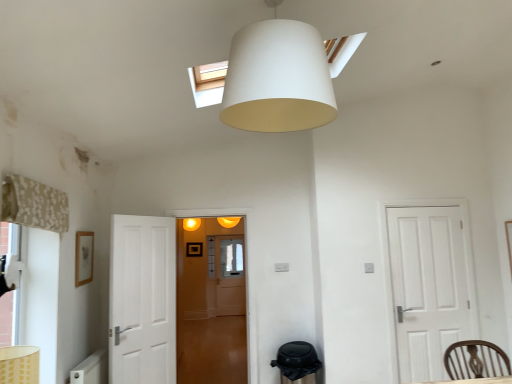
The height and width of the screenshot is (384, 512). Find the location of `beige floral fabric curtain at left`. beige floral fabric curtain at left is located at coordinates (34, 204).

Identify the location of translucent wooden door at center. click(x=211, y=305).

Identify the location of white matte door at right. Image resolution: width=512 pixels, height=384 pixels. (428, 287).

Locate an element on the screen. Image resolution: width=512 pixels, height=384 pixels. beige floral fabric curtain at left is located at coordinates (34, 204).

From a real-world perspective, is beige floral fabric curtain at left over translucent wooden door at center?

Correct, in the physical world, beige floral fabric curtain at left is higher than translucent wooden door at center.

Can you confirm if beige floral fabric curtain at left is thinner than translucent wooden door at center?

Correct, the width of beige floral fabric curtain at left is less than that of translucent wooden door at center.

From the image's perspective, does beige floral fabric curtain at left appear higher than translucent wooden door at center?

Correct, beige floral fabric curtain at left appears higher than translucent wooden door at center in the image.

Measure the distance between beige floral fabric curtain at left and translucent wooden door at center.

The distance of beige floral fabric curtain at left from translucent wooden door at center is 10.75 feet.

Based on the photo, would you say white matte door at right is inside or outside white matte lampshade at upper center?

white matte door at right exists outside the volume of white matte lampshade at upper center.

Find the location of a particular element. door on the right of white matte lampshade at upper center is located at coordinates (428, 287).

Relative to white matte lampshade at upper center, is white matte door at right in front or behind?

white matte door at right is behind white matte lampshade at upper center.

Are white matte door at right and white matte lampshade at upper center located far from each other?

white matte door at right is far away from white matte lampshade at upper center.

Is white matte lampshade at upper center wider or thinner than white matte door at right?

In the image, white matte lampshade at upper center appears to be wider than white matte door at right.

How many degrees apart are the facing directions of white matte lampshade at upper center and white matte door at right?

white matte lampshade at upper center and white matte door at right are facing 89.7 degrees away from each other.

Looking at this image, from the image's perspective, which one is positioned lower, white matte lampshade at upper center or white matte door at right?

white matte door at right, from the image's perspective.

Considering the relative sizes of white matte lampshade at upper center and white matte door at right in the image provided, is white matte lampshade at upper center smaller than white matte door at right?

No.

Is beige floral fabric curtain at left looking in the opposite direction of white matte lampshade at upper center?

beige floral fabric curtain at left does not have its back to white matte lampshade at upper center.

Is point (7, 202) closer or farther from the camera than point (258, 46)?

Point (7, 202) is positioned farther from the camera compared to point (258, 46).

Which object is closer to the camera, beige floral fabric curtain at left or white matte lampshade at upper center?

white matte lampshade at upper center is more forward.

Considering the relative positions of beige floral fabric curtain at left and white matte lampshade at upper center in the image provided, is beige floral fabric curtain at left to the right of white matte lampshade at upper center from the viewer's perspective?

In fact, beige floral fabric curtain at left is to the left of white matte lampshade at upper center.

Which object is further away from the camera, white matte door at right or beige floral fabric curtain at left?

white matte door at right is further away from the camera.

There is a white matte door at right. At what (x,y) coordinates should I click in order to perform the action: click on curtain above it (from a real-world perspective). Please return your answer as a coordinate pair (x, y). Image resolution: width=512 pixels, height=384 pixels. Looking at the image, I should click on (34, 204).

Who is smaller, white matte door at right or beige floral fabric curtain at left?

beige floral fabric curtain at left is smaller.

From the picture: Are white matte door at right and beige floral fabric curtain at left far apart?

white matte door at right is positioned a significant distance from beige floral fabric curtain at left.

Which object is more forward, translucent wooden door at center or white matte lampshade at upper center?

Positioned in front is white matte lampshade at upper center.

In terms of width, does translucent wooden door at center look wider or thinner when compared to white matte lampshade at upper center?

Clearly, translucent wooden door at center has less width compared to white matte lampshade at upper center.

Is translucent wooden door at center oriented away from white matte lampshade at upper center?

No.

Is point (473, 354) behind point (11, 213)?

Yes, it is.

Is brown wooden chair at lower right beside beige floral fabric curtain at left?

They are not placed beside each other.

Which of these two, brown wooden chair at lower right or beige floral fabric curtain at left, is thinner?

With smaller width is beige floral fabric curtain at left.

In terms of height, does brown wooden chair at lower right look taller or shorter compared to beige floral fabric curtain at left?

In the image, brown wooden chair at lower right appears to be taller than beige floral fabric curtain at left.

Find the location of `glass door behind the beige floral fabric curtain at left`. glass door behind the beige floral fabric curtain at left is located at coordinates (211, 305).

Where is `lamp that appears in front of the white matte door at right`? This screenshot has width=512, height=384. lamp that appears in front of the white matte door at right is located at coordinates (277, 78).

Which object lies further to the anchor point translucent wooden door at center, white matte door at right or white matte lampshade at upper center?

Among the two, white matte lampshade at upper center is located further to translucent wooden door at center.

From the image, which object appears to be farther from white matte lampshade at upper center, brown wooden chair at lower right or beige floral fabric curtain at left?

brown wooden chair at lower right.

Based on their spatial positions, is translucent wooden door at center or beige floral fabric curtain at left further from white matte lampshade at upper center?

translucent wooden door at center is positioned further to the anchor white matte lampshade at upper center.

Estimate the real-world distances between objects in this image. Which object is further from translucent wooden door at center, brown wooden chair at lower right or white matte lampshade at upper center?

white matte lampshade at upper center.

Estimate the real-world distances between objects in this image. Which object is further from translucent wooden door at center, white matte door at right or brown wooden chair at lower right?

Based on the image, brown wooden chair at lower right appears to be further to translucent wooden door at center.

Which object lies further to the anchor point brown wooden chair at lower right, white matte lampshade at upper center or beige floral fabric curtain at left?

beige floral fabric curtain at left lies further to brown wooden chair at lower right than the other object.

Estimate the real-world distances between objects in this image. Which object is closer to brown wooden chair at lower right, translucent wooden door at center or white matte door at right?

white matte door at right is closer to brown wooden chair at lower right.

When comparing their distances from brown wooden chair at lower right, does white matte door at right or beige floral fabric curtain at left seem closer?

Among the two, white matte door at right is located nearer to brown wooden chair at lower right.

Where is `chair located between white matte lampshade at upper center and white matte door at right in the depth direction`? The height and width of the screenshot is (384, 512). chair located between white matte lampshade at upper center and white matte door at right in the depth direction is located at coordinates (475, 360).

Locate an element on the screen. This screenshot has height=384, width=512. chair situated between translucent wooden door at center and white matte door at right from left to right is located at coordinates (475, 360).

Where is `door located between white matte lampshade at upper center and translucent wooden door at center in the depth direction`? The width and height of the screenshot is (512, 384). door located between white matte lampshade at upper center and translucent wooden door at center in the depth direction is located at coordinates (428, 287).

The height and width of the screenshot is (384, 512). What are the coordinates of `lamp between beige floral fabric curtain at left and brown wooden chair at lower right in the horizontal direction` in the screenshot? It's located at (277, 78).